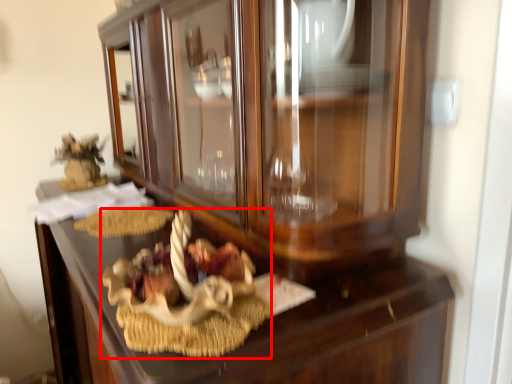
Question: From the image's perspective, where is stuff (annotated by the red box) located in relation to drawer in the image?

Choices:
 (A) above
 (B) below

Answer: (A)